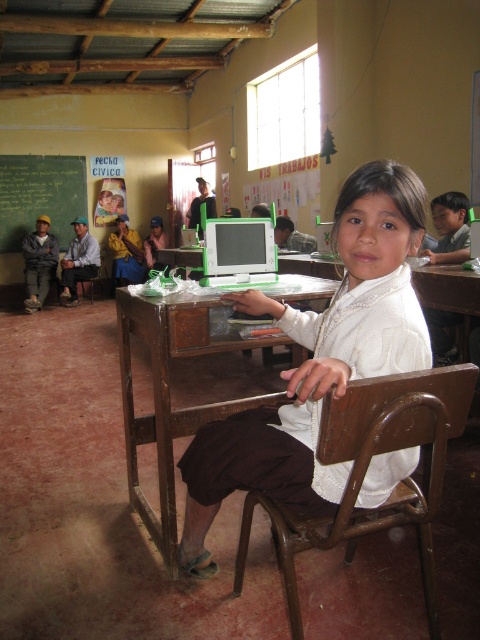
You are a photographer standing in the classroom scene. You want to take a photo that includes both the point at (313, 346) and the point at (41, 288). Which point should you focus on to ensure both are in sharp focus?

You should focus on the point at (41, 288) because it is farther from the camera than the point at (313, 346). By focusing on the farther point, both points will be within the depth of field and appear sharp.

You are a student who wants to place a 1.5 meter long project board on the brown wooden table at center. Can you fit it on the table?

The brown wooden table at center is 1.67 meters from viewer, so the distance is sufficient to place the 1.5 meter long project board on it.

You are standing in the classroom and want to walk from point (x=66, y=205) to point (x=156, y=417). Which direction should you move in relation to the girl sitting at the desk?

You should move forward towards the girl sitting at the desk because point (x=156, y=417) is in front of point (x=66, y=205) from the girl perspective.